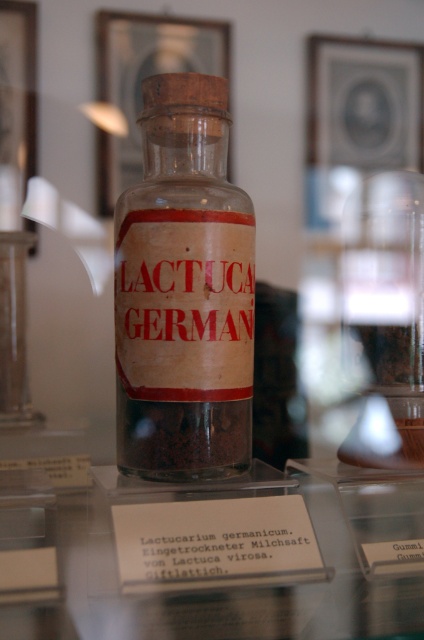
Question: Which object is the closest to the white paper label at center?

Choices:
 (A) transparent glass table at center
 (B) transparent glass jar at center
 (C) transparent glass bottle at center

Answer: (A)

Question: Estimate the real-world distances between objects in this image. Which object is closer to the white paper label at center?

Choices:
 (A) transparent glass jar at center
 (B) transparent glass bottle at center
 (C) transparent glass table at center

Answer: (C)

Question: Is transparent glass jar at center further to the viewer compared to white paper label at center?

Choices:
 (A) no
 (B) yes

Answer: (B)

Question: Which is nearer to the transparent glass table at center?

Choices:
 (A) transparent glass jar at center
 (B) white paper label at center
 (C) transparent glass bottle at center

Answer: (B)

Question: Is transparent glass bottle at center below white paper label at center?

Choices:
 (A) no
 (B) yes

Answer: (A)

Question: From the image, what is the correct spatial relationship of transparent glass table at center in relation to transparent glass bottle at center?

Choices:
 (A) left
 (B) right

Answer: (B)